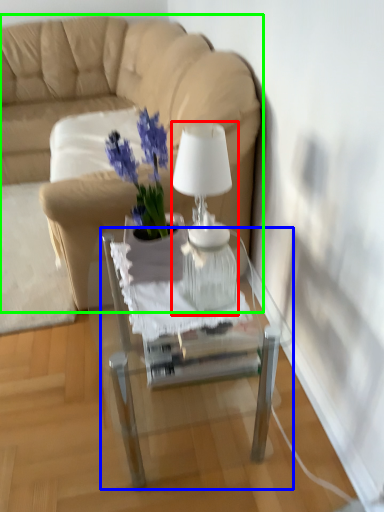
Question: Considering the real-world distances, which object is closest to lamp (highlighted by a red box)? table (highlighted by a blue box) or studio couch (highlighted by a green box).

Choices:
 (A) table
 (B) studio couch

Answer: (A)